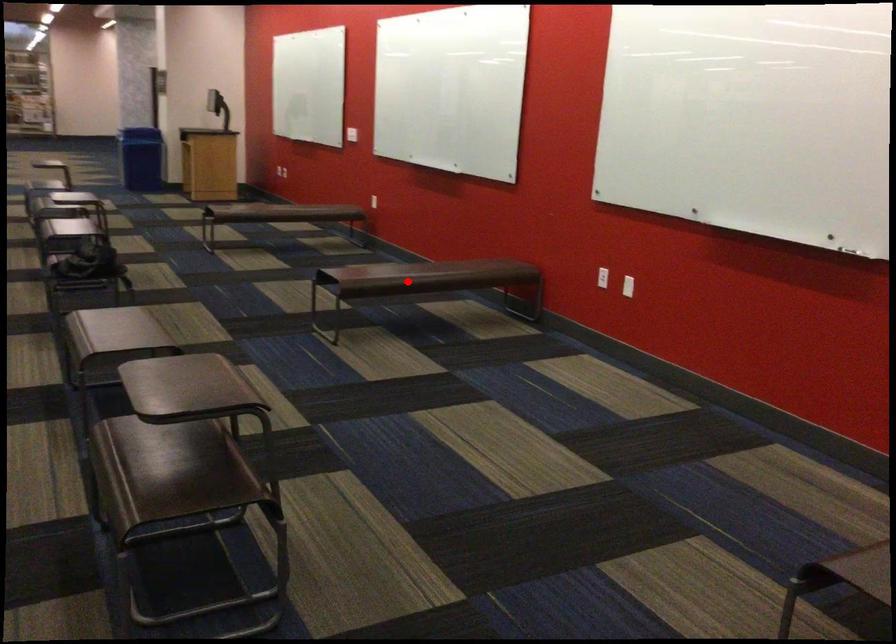
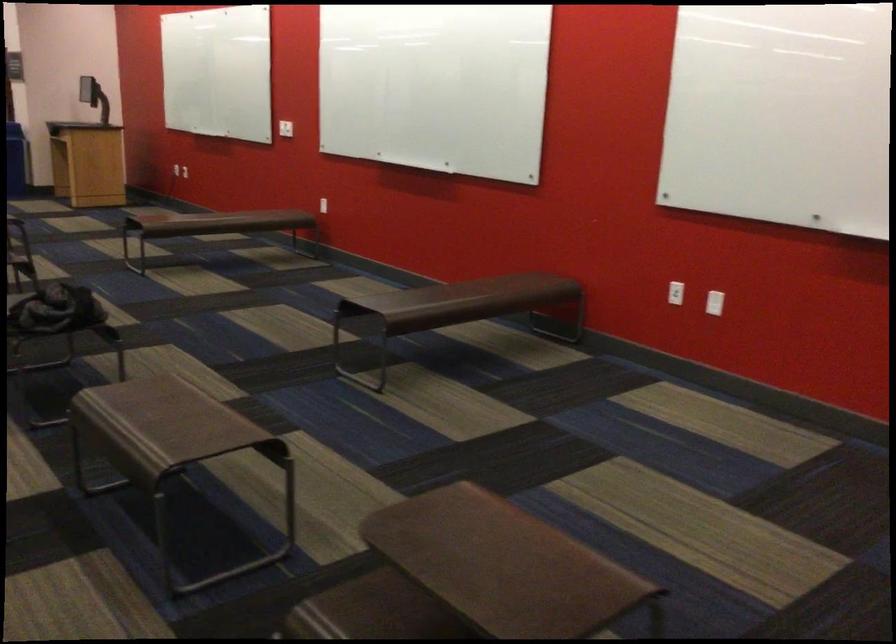
Question: I am providing you with two images of the same scene from different viewpoints. In image1, a red point is highlighted. Considering the same 3D point in image2, which of the following is correct?

Choices:
 (A) It is closer
 (B) It is farther

Answer: (A)